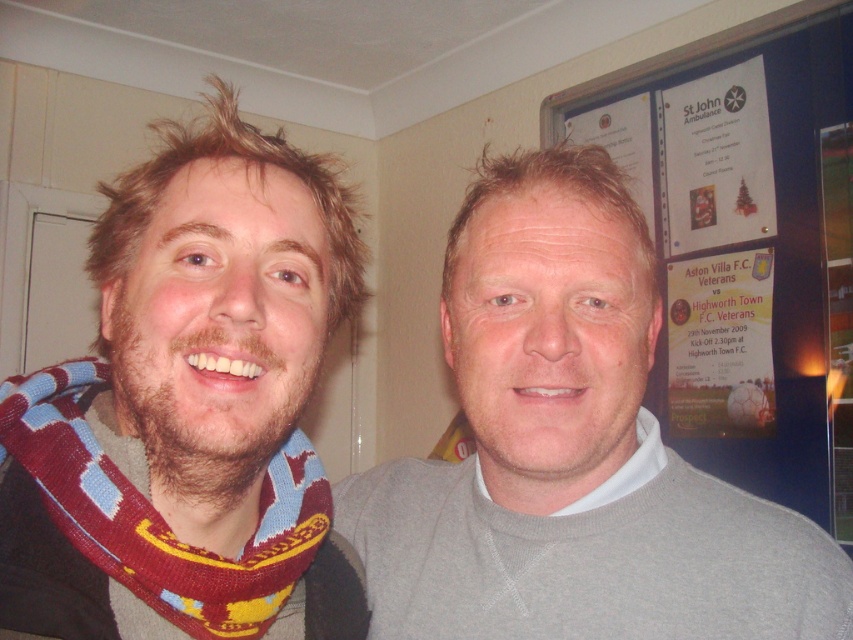
You are taking a photo of two people standing in front of a wall with a bulletin board. You notice two points marked on the image at coordinates point (819, 365) and point (90, 513). Which point is closer to the camera?

Point (819, 365) is further to the camera than point (90, 513), so the point closer to the camera is point (90, 513).

You are trying to decide which item to take with you for a chilly day. Based on the image, which item is narrower, the knitted scarf at left or the gray matte sweater at center?

The knitted scarf at left is narrower than the gray matte sweater at center.

You are a photographer trying to capture a clear shot of the gray matte sweater at center without the white paper poster at upper right blocking it. What adjustment could you make to your camera angle?

The gray matte sweater at center is positioned under the white paper poster at upper right, so tilting the camera downward slightly would allow you to frame the sweater while avoiding the poster above it.